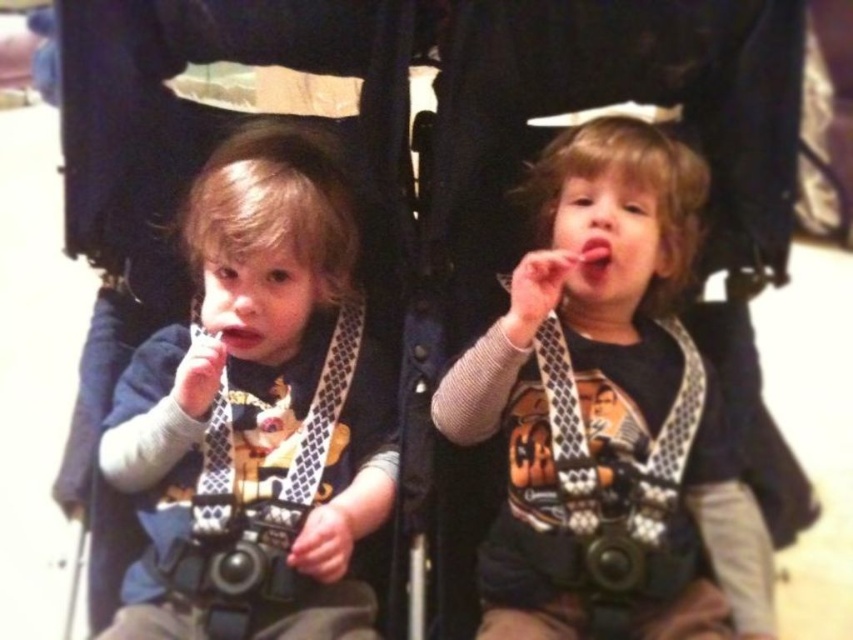
Question: Does matte black bib at left have a lesser width compared to pink matte lips at center?

Choices:
 (A) no
 (B) yes

Answer: (A)

Question: Which object is positioned closest to the matte black bib at left?

Choices:
 (A) pink glossy tongue at center
 (B) black textured suspenders at center

Answer: (B)

Question: Which point is farther to the camera?

Choices:
 (A) (595, 260)
 (B) (250, 328)
 (C) (654, 186)

Answer: (C)

Question: Which object is the closest to the pink matte lips at center?

Choices:
 (A) black textured suspenders at center
 (B) matte black shirt at center

Answer: (B)

Question: Is matte black bib at left closer to camera compared to pink glossy tongue at center?

Choices:
 (A) no
 (B) yes

Answer: (B)

Question: Is matte black bib at left in front of pink glossy tongue at center?

Choices:
 (A) yes
 (B) no

Answer: (A)